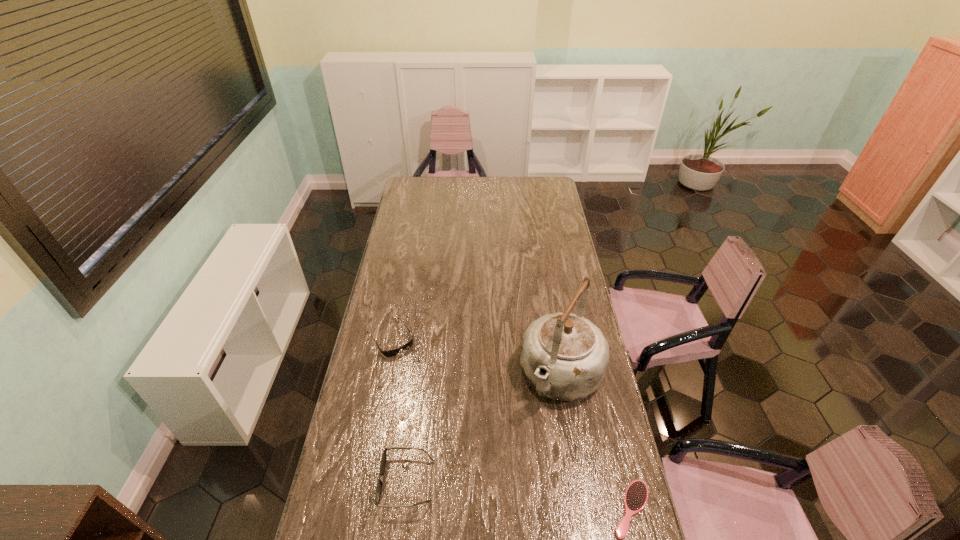
Locate an element on the screen. vacant space located 0.180m at the spout of the tallest object is located at coordinates (520, 454).

Where is `vacant region located at the spout of the tallest object`? vacant region located at the spout of the tallest object is located at coordinates (523, 449).

I want to click on sunglasses situated at the near edge, so click(x=383, y=459).

Identify the location of hairbrush positioned at the near edge. (636, 495).

Find the location of a particular element. hairbrush that is positioned at the right edge is located at coordinates (636, 495).

Find the location of `kettle that is at the right edge`. kettle that is at the right edge is located at coordinates (564, 356).

Locate an element on the screen. This screenshot has height=540, width=960. object that is at the near left corner is located at coordinates (383, 459).

I want to click on object located at the near right corner, so click(636, 495).

This screenshot has width=960, height=540. What are the coordinates of `vacant area at the far edge` in the screenshot? It's located at pos(501,187).

Find the location of a particular element. The height and width of the screenshot is (540, 960). vacant region at the near edge is located at coordinates (514, 515).